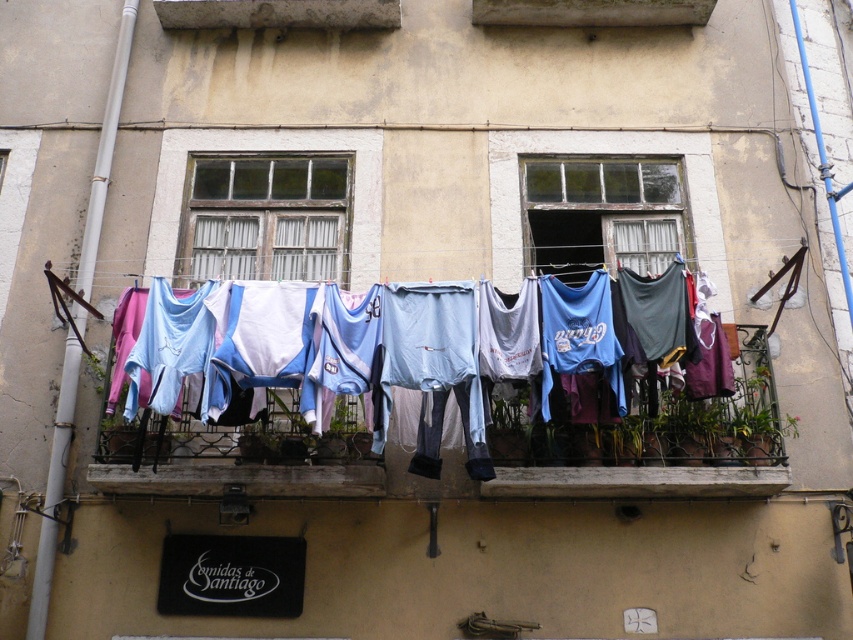
You are standing on the balcony and see the point at coordinates [463,481]. What is located at that point?

The point at [463,481] is on fabric clothes at center.

You are standing on the balcony looking at the clothesline. There are two points marked on the clothesline at coordinates point [727,483] and point [317,208]. Which point is closer to you?

Point [727,483] is closer to the camera than point [317,208].

You are standing on the balcony and want to hang a new piece of clothing. There are two points marked on the clothesline at coordinates point (219, 228) and point (624, 186). Which point is closer to you when looking from your standing position?

Point (219, 228) is in front of point (624, 186), so it is closer to you when looking from your standing position on the balcony.